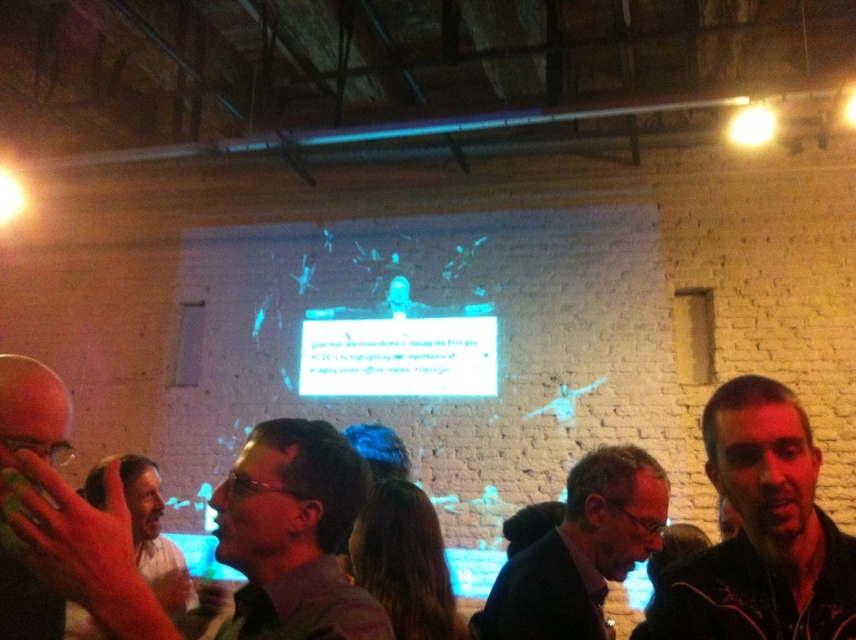
You are a photographer at the event and need to capture a clear shot of the matte black glasses at center without the smooth skin hand at lower left blocking it. How should you adjust your camera position?

Move the camera upwards so that the smooth skin hand at lower left is no longer obscuring the matte black glasses at center, as the glasses are currently positioned under the hand.

You are standing in the room and want to place a small plant on the floor exactly at the point marked as point [242,540]. If your arm reaches 1 meter, can you comfortably place the plant there without moving your feet?

The point [242,540] is 1.11 meters away from you. Since your arm can only reach 1 meter, you cannot comfortably place the plant there without moving your feet.

From the picture: You are standing in the room and want to touch both the smooth skin hand at lower left and the smooth leather jacket at lower left. Which one can you reach first without moving your position?

The smooth skin hand at lower left is closer to the viewer than the smooth leather jacket at lower left, so you can reach the smooth skin hand at lower left first without moving your position.